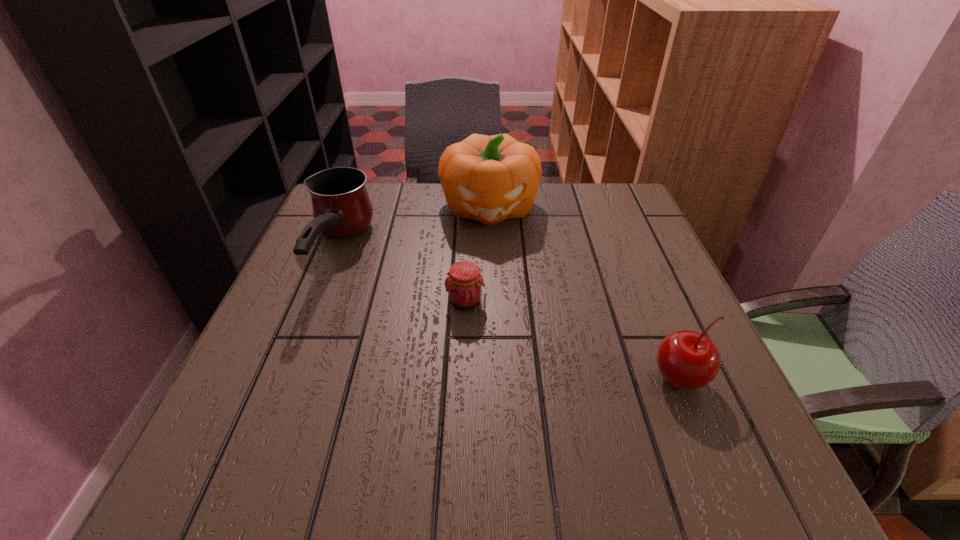
The width and height of the screenshot is (960, 540). Identify the location of pumpkin situated at the far edge. (490, 179).

The width and height of the screenshot is (960, 540). What are the coordinates of `saucepan situated at the far edge` in the screenshot? It's located at (342, 208).

Where is `object located in the left edge section of the desktop`? This screenshot has height=540, width=960. object located in the left edge section of the desktop is located at coordinates (342, 208).

Where is `object present at the right edge`? object present at the right edge is located at coordinates (688, 360).

Locate an element on the screen. The image size is (960, 540). object present at the far left corner is located at coordinates (342, 208).

This screenshot has width=960, height=540. Find the location of `vacant space at the far edge of the desktop`. vacant space at the far edge of the desktop is located at coordinates (450, 212).

Where is `free space at the near edge of the desktop`? free space at the near edge of the desktop is located at coordinates (535, 494).

The width and height of the screenshot is (960, 540). In the image, there is a desktop. In order to click on free space at the left edge in this screenshot , I will do `click(288, 296)`.

In the image, there is a desktop. What are the coordinates of `vacant space at the right edge` in the screenshot? It's located at (663, 251).

Where is `vacant space at the near left corner of the desktop`? Image resolution: width=960 pixels, height=540 pixels. vacant space at the near left corner of the desktop is located at coordinates (261, 498).